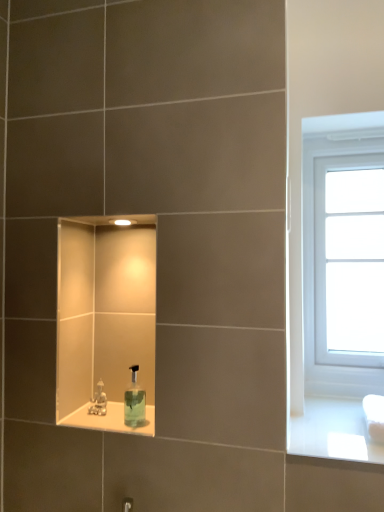
The image size is (384, 512). I want to click on empty space that is ontop of clear glass soap dispenser at center (from a real-world perspective), so click(x=116, y=418).